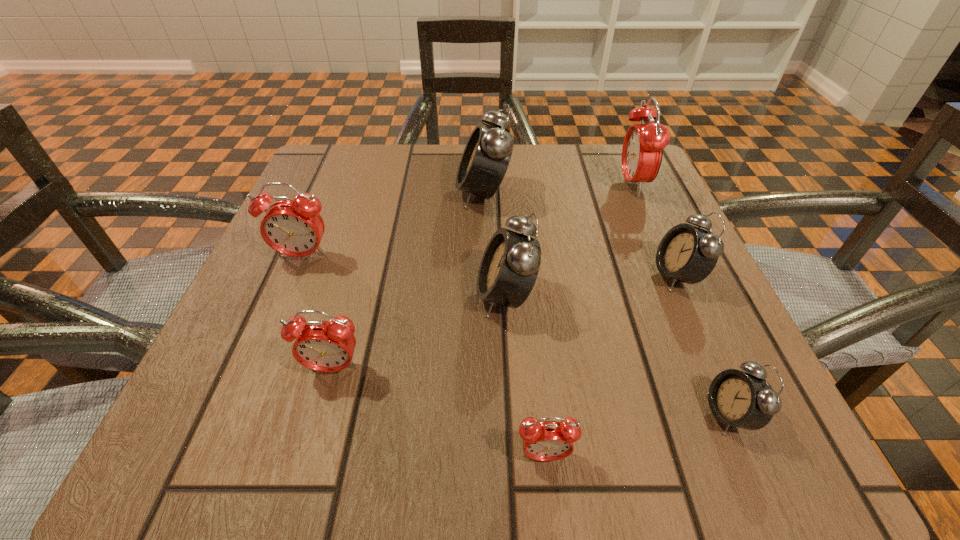
Where is `object located at the near right corner`? object located at the near right corner is located at coordinates (745, 400).

Locate an element on the screen. The image size is (960, 540). vacant region at the far edge of the desktop is located at coordinates (567, 167).

Image resolution: width=960 pixels, height=540 pixels. I want to click on vacant space at the left edge of the desktop, so click(x=355, y=258).

You are a GUI agent. You are given a task and a screenshot of the screen. Output one action in this format:
    pyautogui.click(x=<x>, y=<y>)
    Task: Click on the vacant area at the right edge of the desktop
    The image size is (960, 540).
    Given the screenshot: What is the action you would take?
    pyautogui.click(x=662, y=307)

Identify the location of free space at the far left corner. This screenshot has width=960, height=540. (346, 146).

Where is `free space at the near left corner`? free space at the near left corner is located at coordinates (274, 461).

The height and width of the screenshot is (540, 960). I want to click on vacant area at the far right corner, so click(639, 205).

Find the location of a particular element. The height and width of the screenshot is (540, 960). free location at the near right corner is located at coordinates (650, 407).

Image resolution: width=960 pixels, height=540 pixels. In order to click on free spot between the third red alarm clock from right to left and the nearest white alarm clock in this screenshot , I will do `click(531, 392)`.

Identify the location of vacant space that's between the third smallest white alarm clock and the farthest red alarm clock. (569, 240).